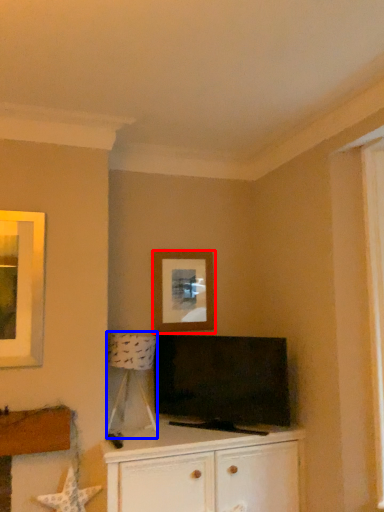
Question: Which object is closer to the camera taking this photo, picture frame (highlighted by a red box) or lamp (highlighted by a blue box)?

Choices:
 (A) picture frame
 (B) lamp

Answer: (B)